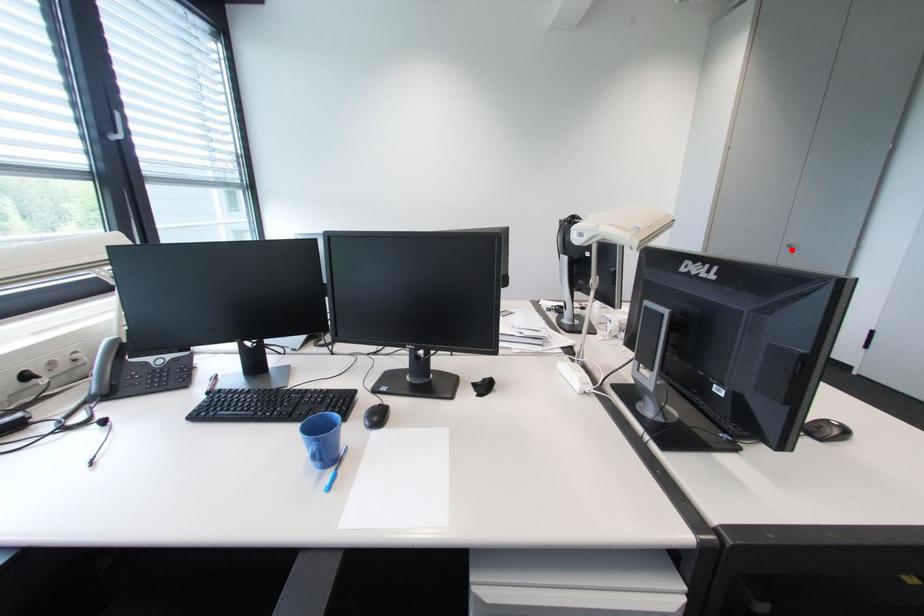
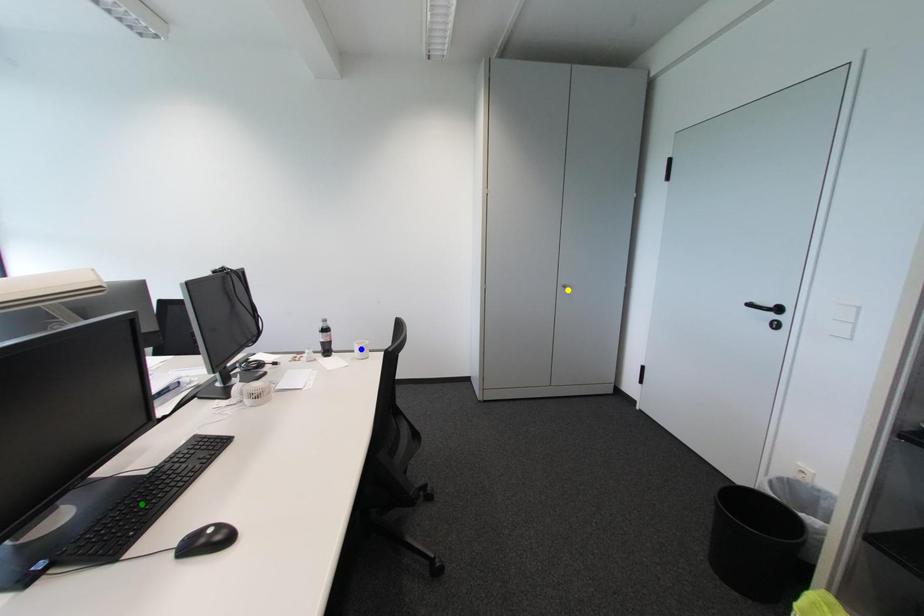
Question: I am providing you with two images of the same scene from different viewpoints. A red point is marked on the first image. You are given multiple points on the second image. Can you choose the point in image 2 that corresponds to the point in image 1?

Choices:
 (A) blue point
 (B) green point
 (C) yellow point

Answer: (C)